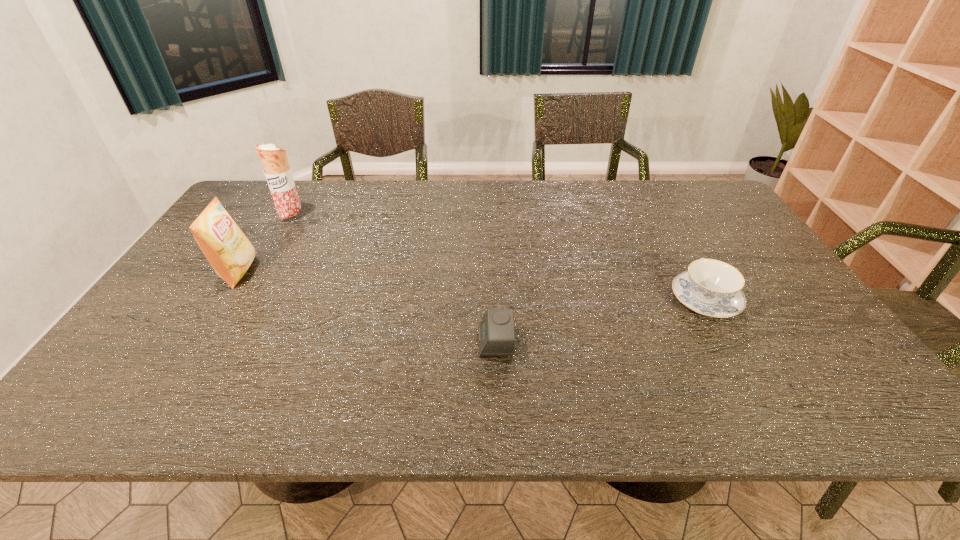
Find the location of `vacant space at the left edge of the desktop`. vacant space at the left edge of the desktop is located at coordinates (155, 379).

I want to click on free spot at the right edge of the desktop, so click(x=706, y=247).

The width and height of the screenshot is (960, 540). In the image, there is a desktop. Identify the location of vacant area at the far left corner. (253, 188).

Identify the location of empty location between the second tallest object and the rightmost object. (471, 286).

This screenshot has height=540, width=960. Identify the location of free point between the third shortest object and the rightmost object. (471, 286).

This screenshot has height=540, width=960. Identify the location of vacant area that lies between the second tallest object and the tallest object. (265, 244).

Locate an element on the screen. The height and width of the screenshot is (540, 960). vacant space that's between the third tallest object and the second object from right to left is located at coordinates (600, 320).

At what (x,y) coordinates should I click in order to perform the action: click on free space that is in between the third shortest object and the chinaware. Please return your answer as a coordinate pair (x, y). The width and height of the screenshot is (960, 540). Looking at the image, I should click on (471, 286).

Find the location of a particular element. vacant area between the crisp (potato chip) and the chinaware is located at coordinates (471, 286).

You are a GUI agent. You are given a task and a screenshot of the screen. Output one action in this format:
    pyautogui.click(x=<x>, y=<y>)
    Task: Click on the free point between the second shortest object and the alarm clock
    Image resolution: width=960 pixels, height=540 pixels.
    Given the screenshot: What is the action you would take?
    pyautogui.click(x=600, y=320)